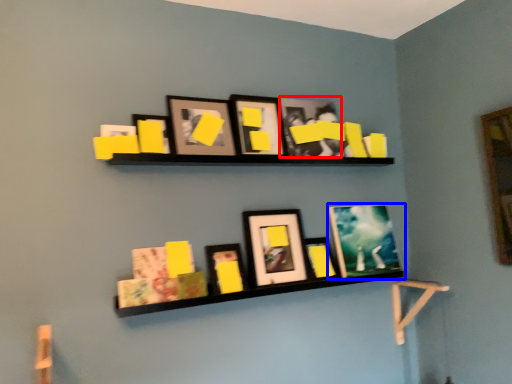
Question: Which of the following is the farthest to the observer, picture frame (highlighted by a red box) or picture frame (highlighted by a blue box)?

Choices:
 (A) picture frame
 (B) picture frame

Answer: (B)